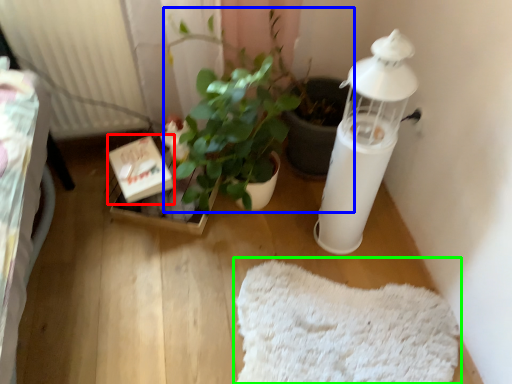
Question: Which is nearer to the cardboard box (highlighted by a red box)? houseplant (highlighted by a blue box) or mat (highlighted by a green box).

Choices:
 (A) houseplant
 (B) mat

Answer: (A)